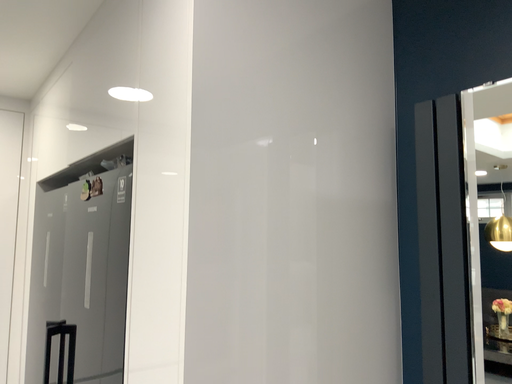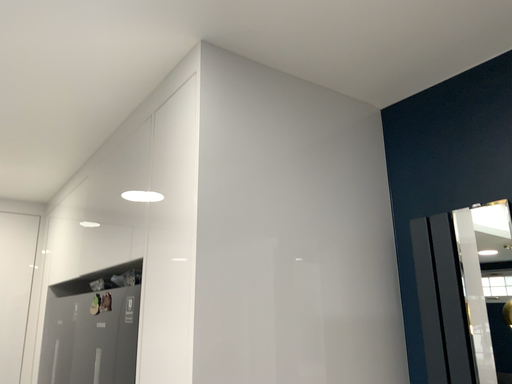
Question: Which way did the camera rotate in the video?

Choices:
 (A) rotated upward
 (B) rotated downward

Answer: (A)